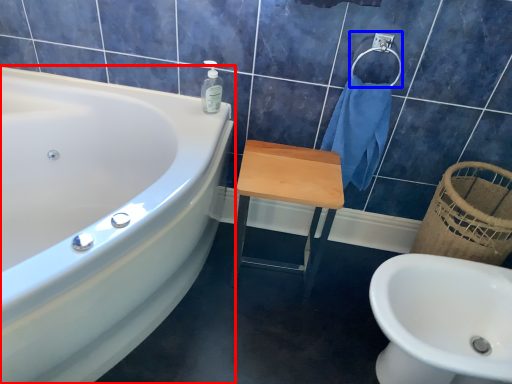
Question: Which point is closer to the camera, bathtub (highlighted by a red box) or towel bar (highlighted by a blue box)?

Choices:
 (A) bathtub
 (B) towel bar

Answer: (A)